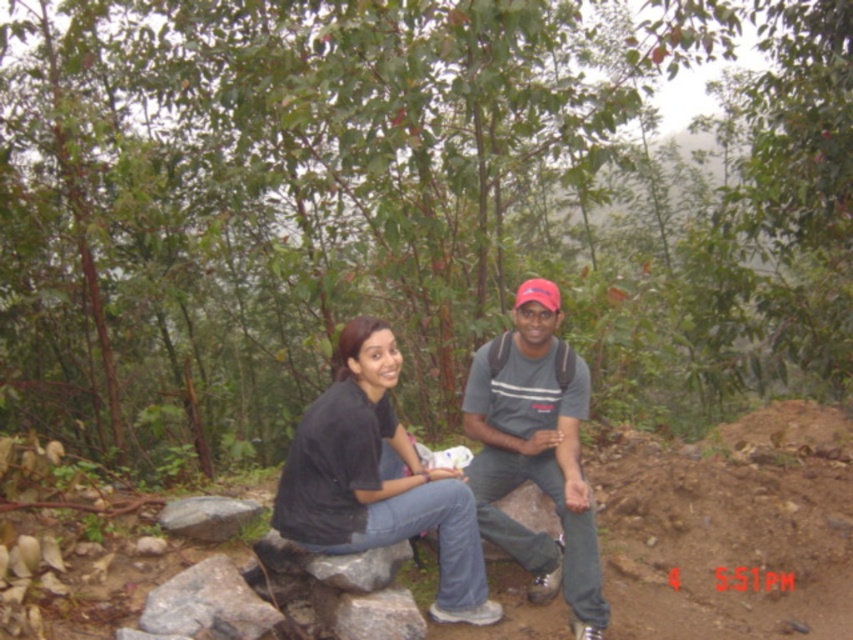
Between black cotton shirt at center and matte gray t-shirt at center, which one appears on the left side from the viewer's perspective?

Positioned to the left is black cotton shirt at center.

Does black cotton shirt at center have a greater height compared to matte gray t-shirt at center?

No, black cotton shirt at center is not taller than matte gray t-shirt at center.

Between point (444, 557) and point (531, 589), which one is positioned in front?

Point (444, 557)

The height and width of the screenshot is (640, 853). What are the coordinates of `black cotton shirt at center` in the screenshot? It's located at (376, 477).

Is matte gray t-shirt at center in front of gray rough rock at lower left?

Yes.

Is matte gray t-shirt at center to the right of gray rough rock at lower left from the viewer's perspective?

Correct, you'll find matte gray t-shirt at center to the right of gray rough rock at lower left.

Is point (511, 452) positioned behind point (161, 513)?

Yes, it is.

Locate an element on the screen. The image size is (853, 640). matte gray t-shirt at center is located at coordinates click(537, 451).

Is black cotton shirt at center positioned before gray rough rock at lower left?

Yes, it is in front of gray rough rock at lower left.

Does black cotton shirt at center lie behind gray rough rock at lower left?

No, black cotton shirt at center is in front of gray rough rock at lower left.

Does point (355, 378) come in front of point (181, 529)?

Yes, it is in front of point (181, 529).

What are the coordinates of `black cotton shirt at center` in the screenshot? It's located at (376, 477).